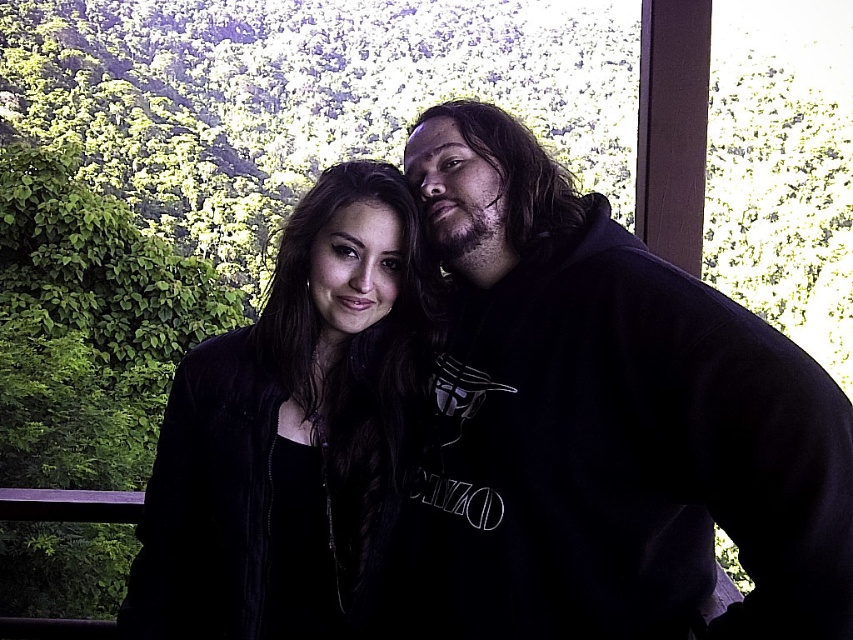
Is black hoodie at center taller than black velvet jacket at center?

Yes.

Does black hoodie at center come in front of black velvet jacket at center?

Yes.

Find the location of a particular element. This screenshot has width=853, height=640. black hoodie at center is located at coordinates (606, 422).

This screenshot has height=640, width=853. In order to click on black hoodie at center in this screenshot , I will do `click(606, 422)`.